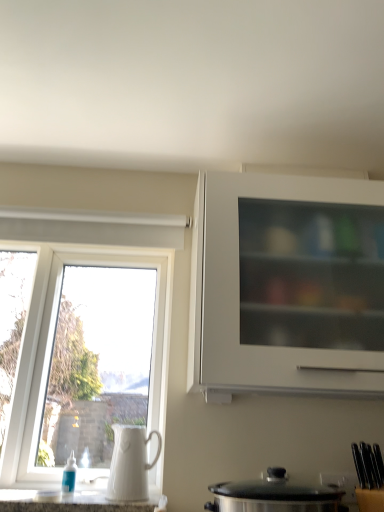
Question: Is the depth of white plastic window at left less than that of white ceramic jug at left?

Choices:
 (A) yes
 (B) no

Answer: (B)

Question: Does white plastic window at left have a larger size compared to white ceramic jug at left?

Choices:
 (A) yes
 (B) no

Answer: (A)

Question: Is white plastic window at left at the left side of white ceramic jug at left?

Choices:
 (A) yes
 (B) no

Answer: (A)

Question: Can you confirm if white plastic window at left is thinner than white ceramic jug at left?

Choices:
 (A) yes
 (B) no

Answer: (A)

Question: Does white plastic window at left have a greater height compared to white ceramic jug at left?

Choices:
 (A) no
 (B) yes

Answer: (B)

Question: From a real-world perspective, does white plastic window at left stand above white ceramic jug at left?

Choices:
 (A) yes
 (B) no

Answer: (A)

Question: Considering the relative positions of white plastic window at left and white glossy countertop at lower center in the image provided, is white plastic window at left to the left of white glossy countertop at lower center from the viewer's perspective?

Choices:
 (A) yes
 (B) no

Answer: (A)

Question: Can you confirm if white plastic window at left is positioned to the right of white glossy countertop at lower center?

Choices:
 (A) no
 (B) yes

Answer: (A)

Question: Is white plastic window at left smaller than white glossy countertop at lower center?

Choices:
 (A) yes
 (B) no

Answer: (B)

Question: Does white plastic window at left have a greater width compared to white glossy countertop at lower center?

Choices:
 (A) yes
 (B) no

Answer: (B)

Question: From a real-world perspective, is white plastic window at left on white glossy countertop at lower center?

Choices:
 (A) no
 (B) yes

Answer: (B)

Question: Is white plastic window at left oriented away from white glossy countertop at lower center?

Choices:
 (A) no
 (B) yes

Answer: (A)

Question: Is the position of stainless steel pot at lower center more distant than that of white matte cabinet at upper right?

Choices:
 (A) no
 (B) yes

Answer: (A)